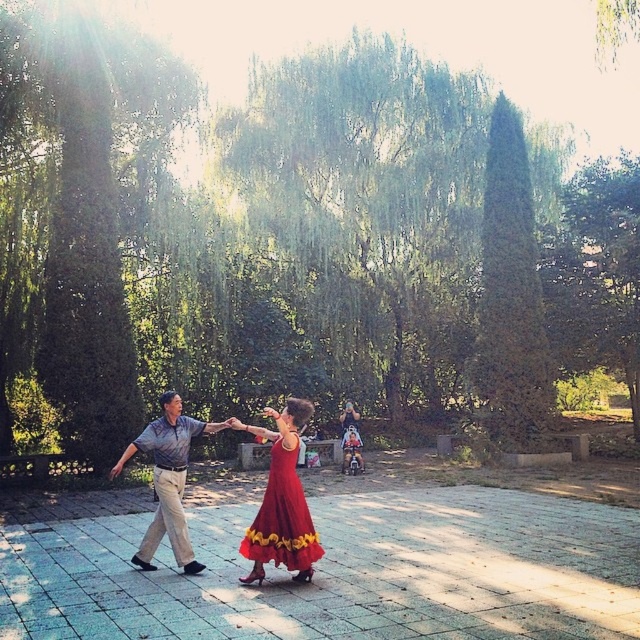
You are a photographer planning to take a photo of the shiny red dress at center. What are the coordinates where you should focus your camera?

The coordinates to focus on are point (282, 500).

You are standing at the origin of the coordinate system in the image. You see a shiny red dress at center located at point (282, 500). Is the shiny red dress at center closer to the top or bottom of the image?

The shiny red dress at center is located at point (282, 500). Since the y coordinate is 0.441, which is closer to 0.5, it is near the center vertically. Therefore, it is neither closer to the top nor the bottom of the image.

You are a photographer trying to capture the couple dancing. You notice the shiny red dress at center and the gray cotton shirt at center. Which clothing item has a narrower width when viewed from your position?

The shiny red dress at center has a narrower width than the gray cotton shirt at center.